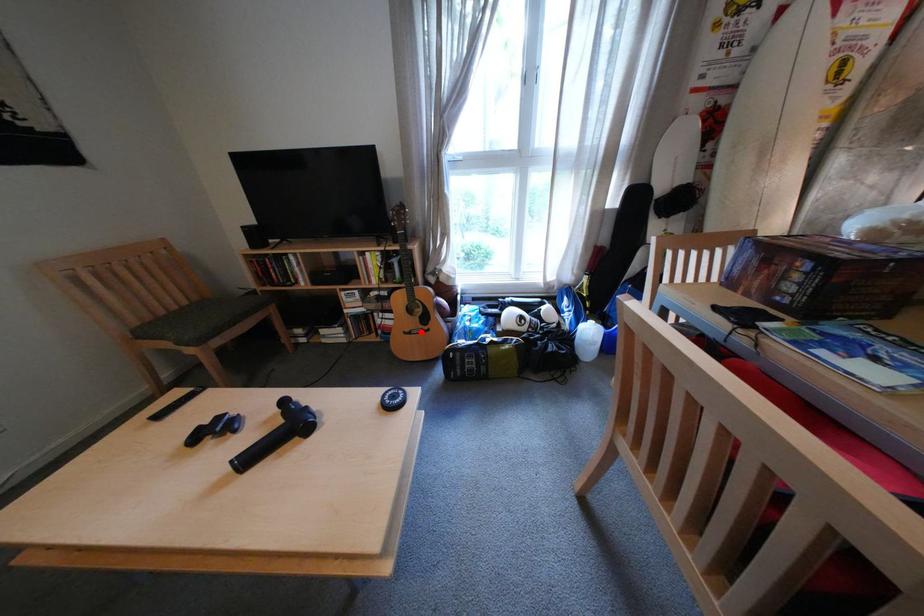
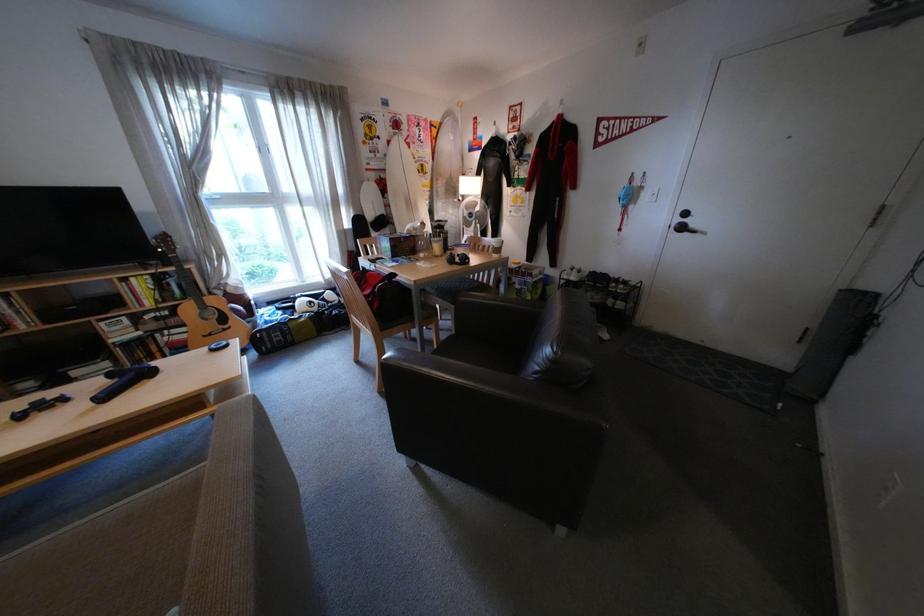
Where in the second image is the point corresponding to the highlighted location from the first image?

(220, 334)